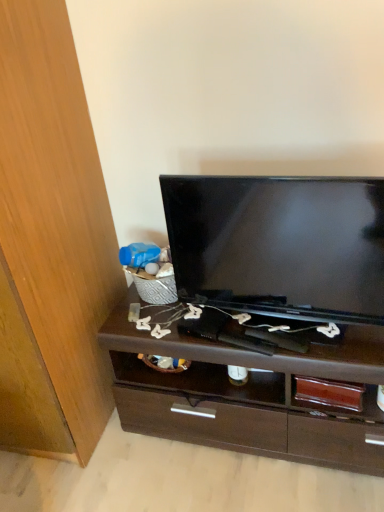
This screenshot has width=384, height=512. I want to click on blank space situated above black glossy television at center (from a real-world perspective), so click(276, 183).